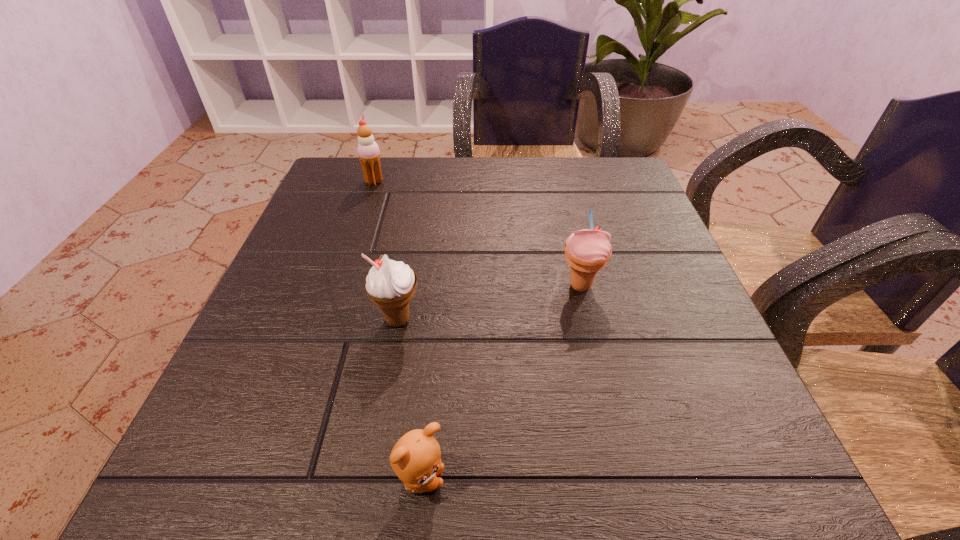
Find the location of `free space between the rightmost icecream and the leftmost icecream`. free space between the rightmost icecream and the leftmost icecream is located at coordinates tap(477, 233).

Where is `vacant area between the second farthest icecream and the leftmost object`? This screenshot has width=960, height=540. vacant area between the second farthest icecream and the leftmost object is located at coordinates (477, 233).

You are a GUI agent. You are given a task and a screenshot of the screen. Output one action in this format:
    pyautogui.click(x=<x>, y=<y>)
    Task: Click on the free space between the second icecream from right to left and the nearest object
    The width and height of the screenshot is (960, 540).
    Given the screenshot: What is the action you would take?
    pyautogui.click(x=409, y=400)

Where is `object identified as the second closest to the rightmost icecream`? object identified as the second closest to the rightmost icecream is located at coordinates (416, 458).

This screenshot has height=540, width=960. What are the coordinates of `object that is the third closest to the leftmost object` in the screenshot? It's located at (416, 458).

Select which icecream is the closest to the farthest object. Please provide its 2D coordinates. Your answer should be formatted as a tuple, i.e. [(x, y)], where the tuple contains the x and y coordinates of a point satisfying the conditions above.

[(390, 284)]

The width and height of the screenshot is (960, 540). I want to click on icecream that is the second nearest to the farthest icecream, so click(587, 251).

Locate an element on the screen. The image size is (960, 540). vacant space that satisfies the following two spatial constraints: 1. at the front with a straw on the leftmost object; 2. on the right side of the rightmost icecream is located at coordinates (339, 286).

Locate an element on the screen. Image resolution: width=960 pixels, height=540 pixels. free location that satisfies the following two spatial constraints: 1. at the front with a straw on the nearest icecream; 2. on the right side of the farthest object is located at coordinates (327, 320).

What are the coordinates of `free space that satisfies the following two spatial constraints: 1. at the front with a straw on the second farthest object; 2. on the right side of the farthest icecream` in the screenshot? It's located at tap(339, 286).